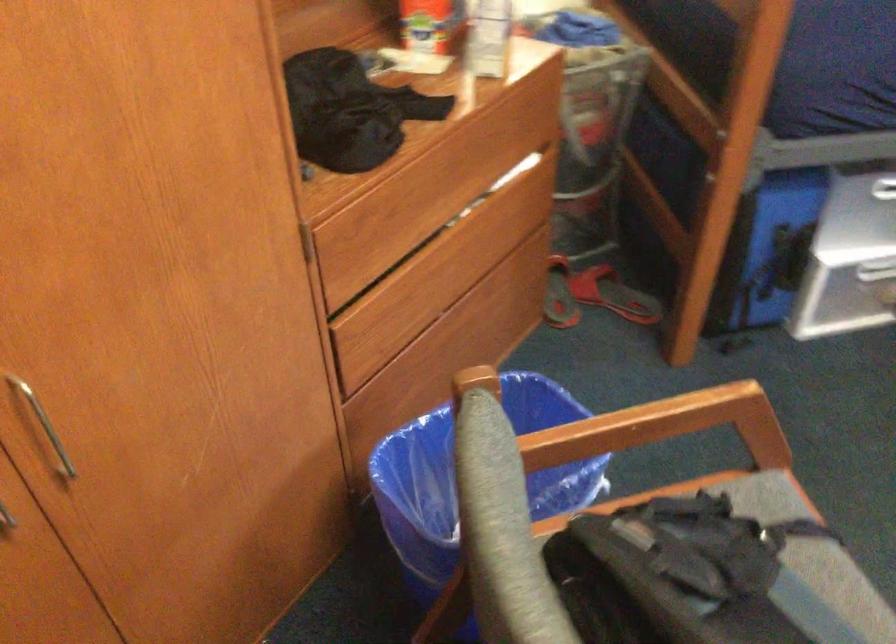
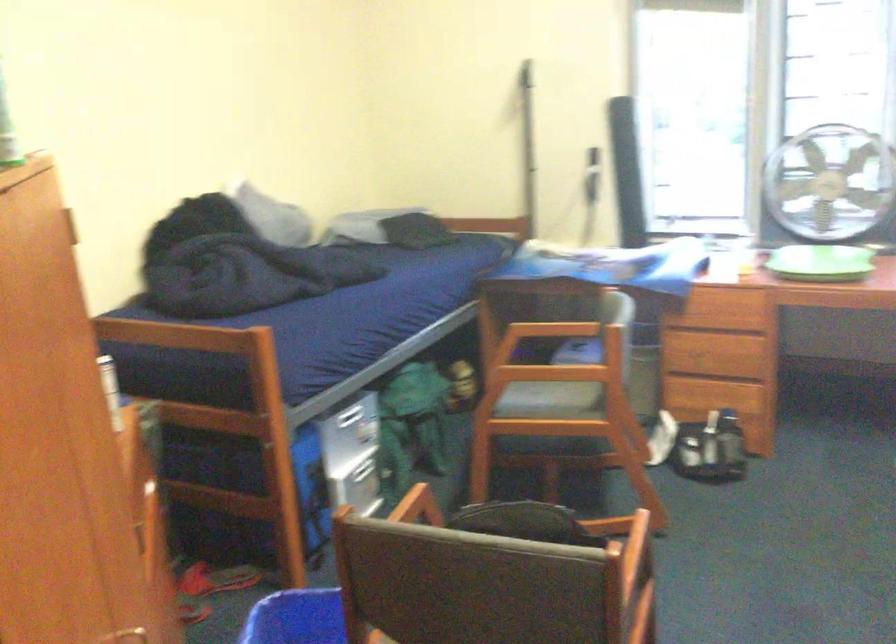
The point at (234, 377) is marked in the first image. Where is the corresponding point in the second image?

(141, 630)